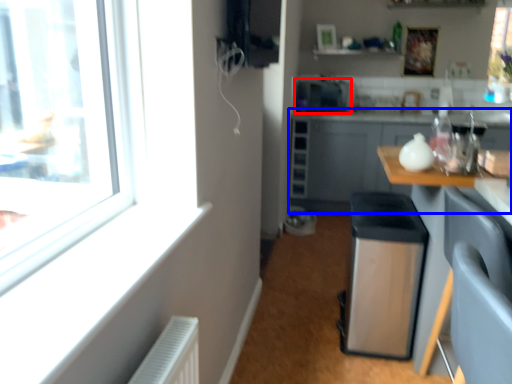
Question: Which point is closer to the camera, appliance (highlighted by a red box) or cabinetry (highlighted by a blue box)?

Choices:
 (A) appliance
 (B) cabinetry

Answer: (B)